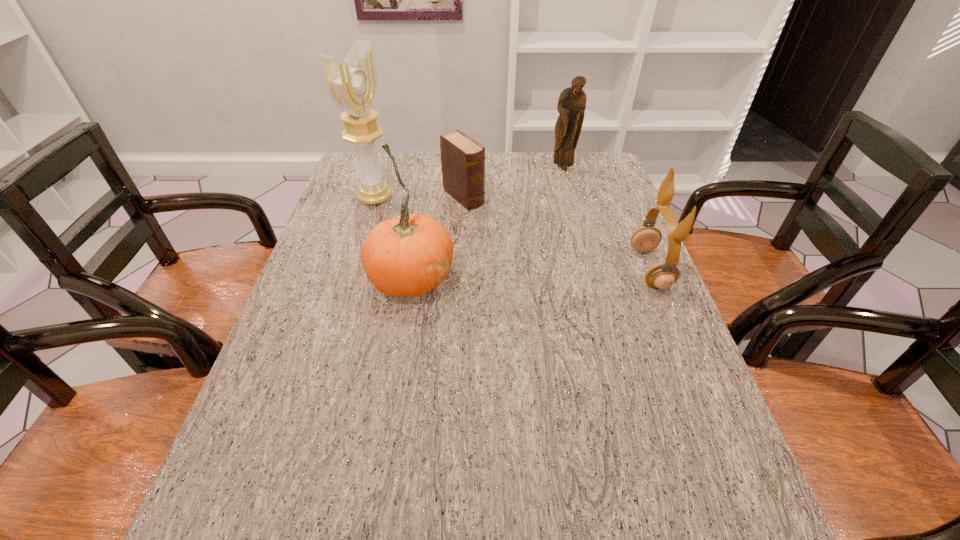
The image size is (960, 540). I want to click on free space at the far left corner of the desktop, so click(389, 174).

Find the location of a particular element. The width and height of the screenshot is (960, 540). free spot at the far right corner of the desktop is located at coordinates (570, 184).

What are the coordinates of `vacant space in between the award and the rightmost object` in the screenshot? It's located at coord(513,233).

You are a GUI agent. You are given a task and a screenshot of the screen. Output one action in this format:
    pyautogui.click(x=<x>, y=<y>)
    Task: Click on the free area in between the diary and the farthest object
    The image size is (960, 540).
    Given the screenshot: What is the action you would take?
    pyautogui.click(x=514, y=183)

I want to click on free space between the award and the diary, so click(x=420, y=197).

Image resolution: width=960 pixels, height=540 pixels. In order to click on vacant space in between the tallest object and the diary in this screenshot , I will do `click(420, 197)`.

Find the location of `free space between the farthest object and the earphone`. free space between the farthest object and the earphone is located at coordinates (607, 219).

Find the location of `vacant point located between the diary and the award`. vacant point located between the diary and the award is located at coordinates (420, 197).

Where is `the second closest object to the award`? the second closest object to the award is located at coordinates point(410,255).

Identify the location of object that is the fourth closest one to the earphone. (352, 85).